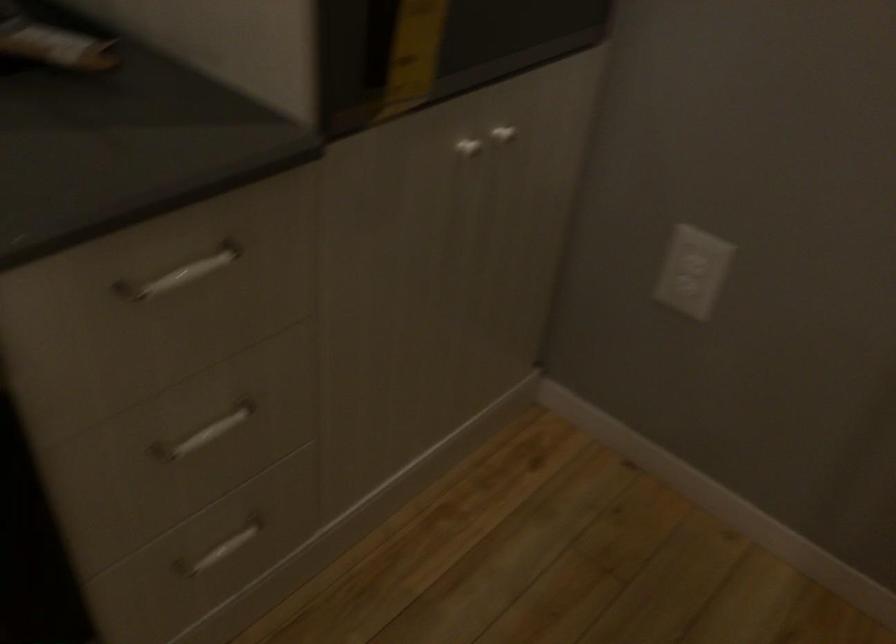
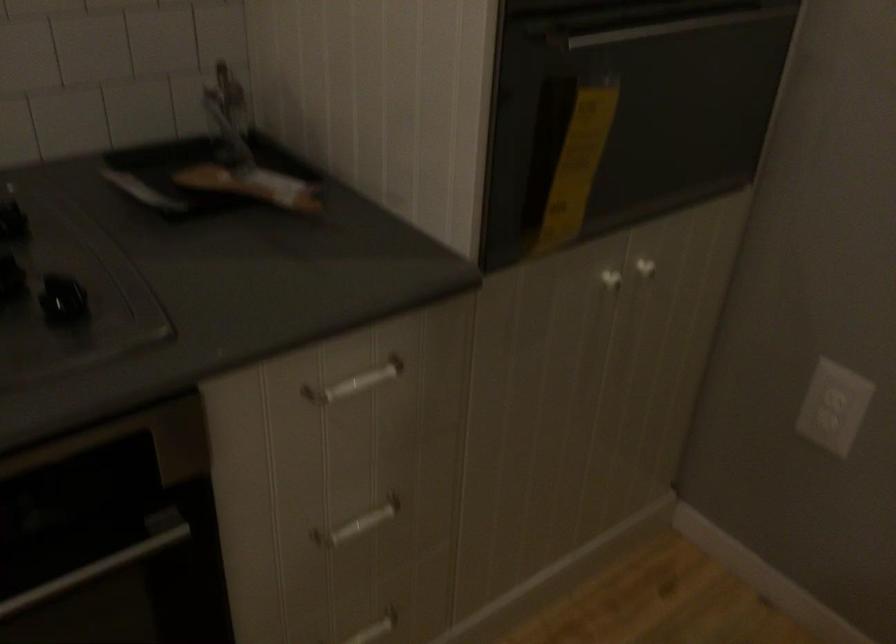
Question: How did the camera likely rotate?

Choices:
 (A) Left
 (B) Right
 (C) Up
 (D) Down

Answer: (A)